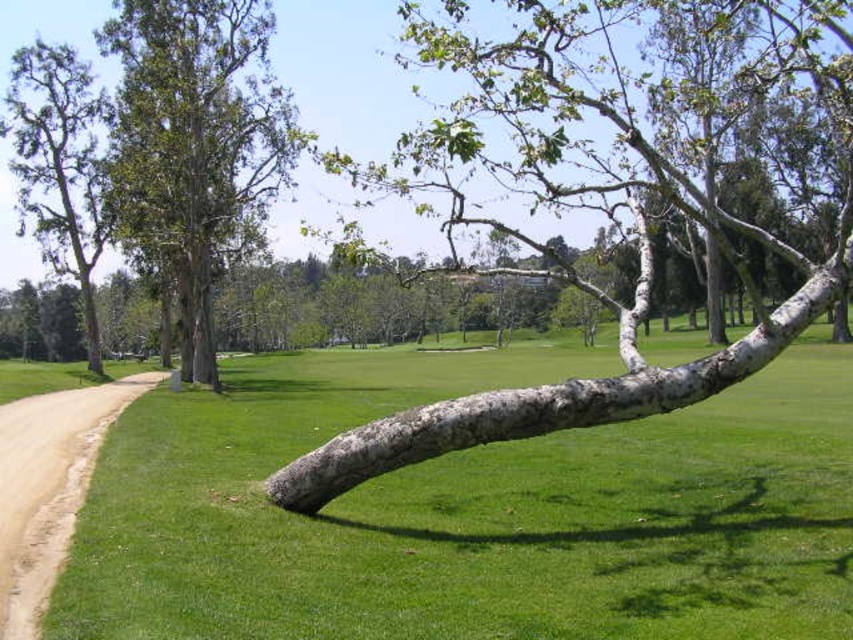
Does green grass at center appear under brown dirt track at left?

Yes, green grass at center is below brown dirt track at left.

Does green grass at center appear on the right side of brown dirt track at left?

Correct, you'll find green grass at center to the right of brown dirt track at left.

The height and width of the screenshot is (640, 853). Identify the location of green grass at center. (473, 512).

In the scene shown: Does green leafy tree at upper left appear over smooth gray bark tree at left?

Correct, green leafy tree at upper left is located above smooth gray bark tree at left.

Does green leafy tree at upper left have a lesser height compared to smooth gray bark tree at left?

In fact, green leafy tree at upper left may be taller than smooth gray bark tree at left.

Is point (170, 115) positioned before point (61, 211)?

That is True.

Locate an element on the screen. Image resolution: width=853 pixels, height=640 pixels. green leafy tree at upper left is located at coordinates (195, 147).

Is point (12, 561) positioned before point (47, 163)?

Yes, it is.

Is brown dirt track at left to the left of smooth gray bark tree at left from the viewer's perspective?

In fact, brown dirt track at left is to the right of smooth gray bark tree at left.

Image resolution: width=853 pixels, height=640 pixels. Find the location of `brown dirt track at left`. brown dirt track at left is located at coordinates (48, 486).